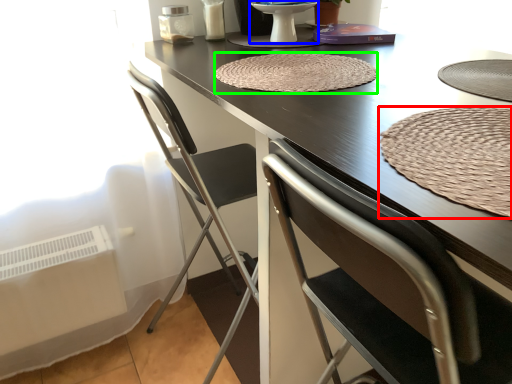
Question: Considering the real-world distances, which object is farthest from mat (highlighted by a red box)? round table (highlighted by a blue box) or mat (highlighted by a green box)?

Choices:
 (A) round table
 (B) mat

Answer: (A)